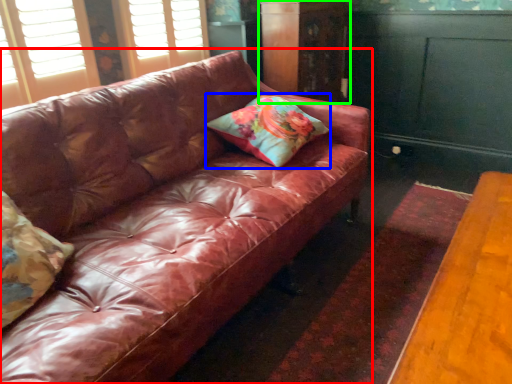
Question: Which is nearer to the studio couch (highlighted by a red box)? pillow (highlighted by a blue box) or dresser (highlighted by a green box).

Choices:
 (A) pillow
 (B) dresser

Answer: (A)